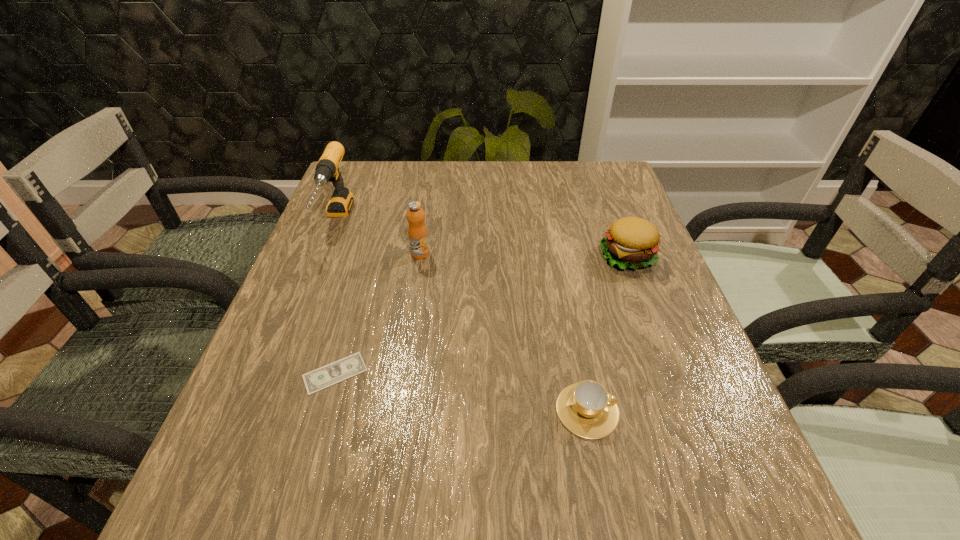
Locate an element on the screen. vacant area situated 0.350m on the front label of the third object from right to left is located at coordinates (399, 393).

Identify the location of vacant space located on the front of the third tallest object. The image size is (960, 540). (701, 450).

Where is `vacant space located 0.080m on the right of the fourth object from right to left`? Image resolution: width=960 pixels, height=540 pixels. vacant space located 0.080m on the right of the fourth object from right to left is located at coordinates (412, 373).

At what (x,y) coordinates should I click in order to perform the action: click on object that is at the far edge. Please return your answer as a coordinate pair (x, y). Looking at the image, I should click on (327, 170).

In order to click on drill at the left edge in this screenshot , I will do `click(327, 170)`.

Find the location of a particular element. The image size is (960, 540). money that is at the left edge is located at coordinates (338, 371).

Image resolution: width=960 pixels, height=540 pixels. Find the location of `object that is positioned at the right edge`. object that is positioned at the right edge is located at coordinates (632, 242).

At what (x,y) coordinates should I click in order to perform the action: click on object that is positioned at the far left corner. Please return your answer as a coordinate pair (x, y). Image resolution: width=960 pixels, height=540 pixels. Looking at the image, I should click on (327, 170).

The image size is (960, 540). I want to click on free space at the far edge, so click(453, 184).

Image resolution: width=960 pixels, height=540 pixels. In the image, there is a desktop. Identify the location of vacant space at the near edge. (540, 532).